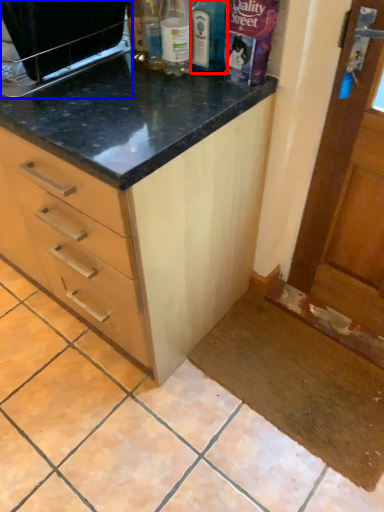
Question: Which object is further to the camera taking this photo, bottle (highlighted by a red box) or appliance (highlighted by a blue box)?

Choices:
 (A) bottle
 (B) appliance

Answer: (A)